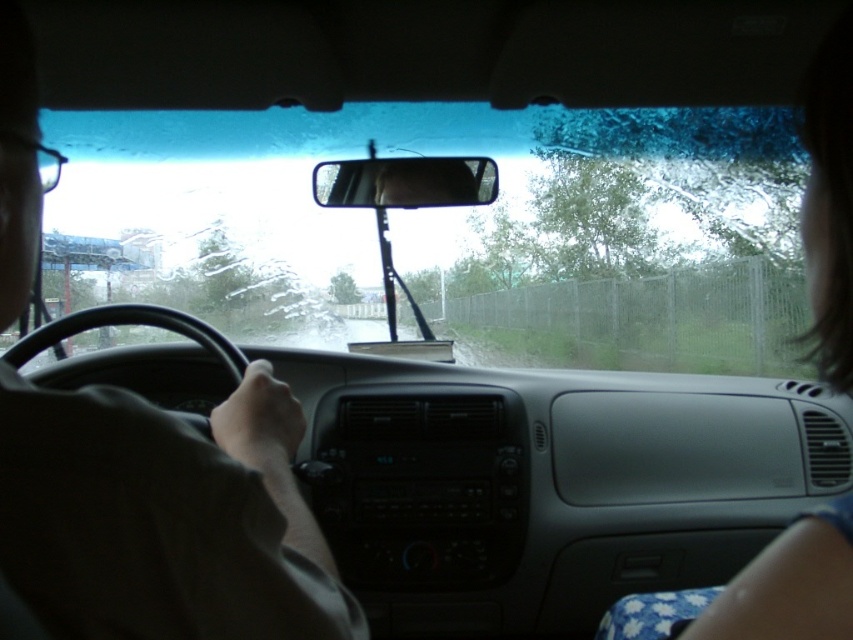
Is transparent glass windshield at center to the right of matte black steering wheel at left from the viewer's perspective?

No, transparent glass windshield at center is not to the right of matte black steering wheel at left.

Is transparent glass windshield at center shorter than matte black steering wheel at left?

In fact, transparent glass windshield at center may be taller than matte black steering wheel at left.

At what (x,y) coordinates should I click in order to perform the action: click on transparent glass windshield at center. Please return your answer as a coordinate pair (x, y). Looking at the image, I should click on (451, 227).

Image resolution: width=853 pixels, height=640 pixels. In order to click on transparent glass windshield at center in this screenshot , I will do `click(451, 227)`.

Is transparent glass windshield at center positioned at the back of clear plastic view mirror at center?

Yes, transparent glass windshield at center is behind clear plastic view mirror at center.

Who is positioned more to the left, transparent glass windshield at center or clear plastic view mirror at center?

transparent glass windshield at center

At what (x,y) coordinates should I click in order to perform the action: click on transparent glass windshield at center. Please return your answer as a coordinate pair (x, y). This screenshot has width=853, height=640. Looking at the image, I should click on (451, 227).

Does matte black steering wheel at left have a greater height compared to clear plastic view mirror at center?

Correct, matte black steering wheel at left is much taller as clear plastic view mirror at center.

Who is higher up, matte black steering wheel at left or clear plastic view mirror at center?

clear plastic view mirror at center is higher up.

Is point (231, 563) positioned behind point (492, 195)?

No.

At what (x,y) coordinates should I click in order to perform the action: click on matte black steering wheel at left. Please return your answer as a coordinate pair (x, y). Image resolution: width=853 pixels, height=640 pixels. Looking at the image, I should click on (163, 516).